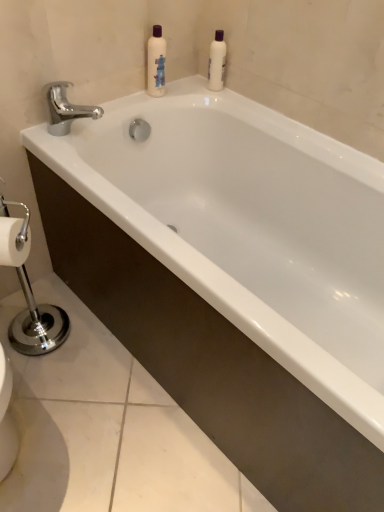
I want to click on free spot to the left of chrome/metallic faucet at upper left, so click(46, 131).